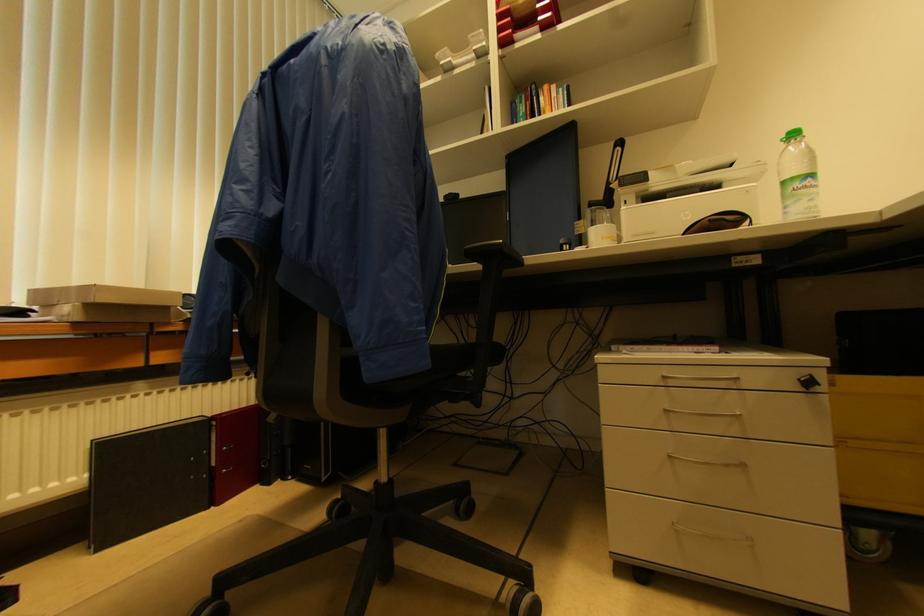
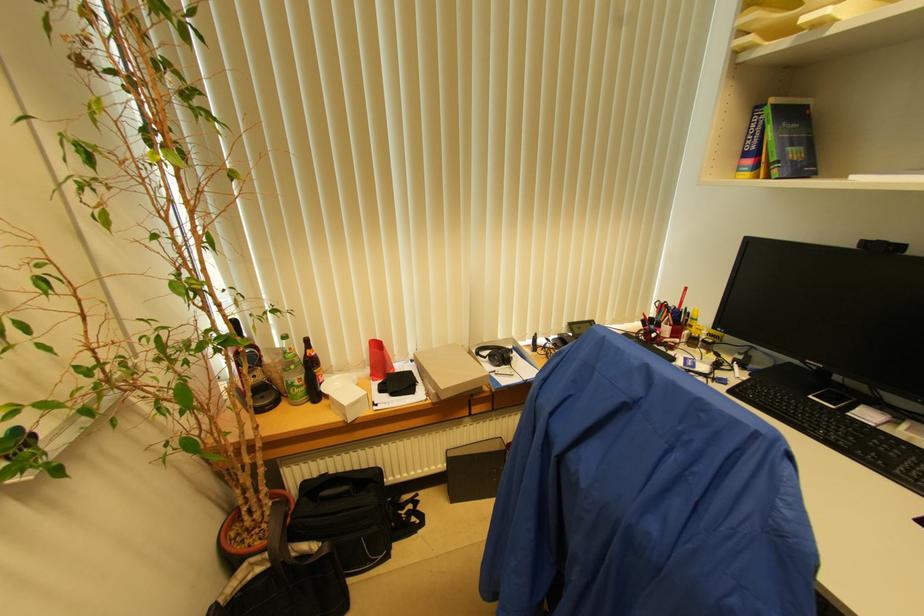
Find the pixel in the second image that matches (x=453, y=201) in the first image.

(882, 251)